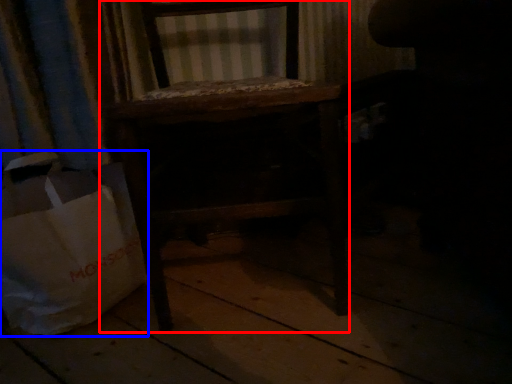
Question: Which object appears closest to the camera in this image, furniture (highlighted by a red box) or grocery bag (highlighted by a blue box)?

Choices:
 (A) furniture
 (B) grocery bag

Answer: (A)